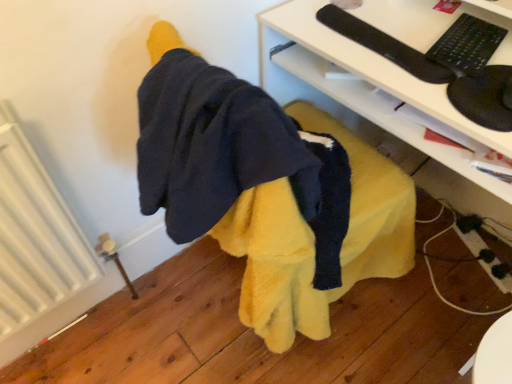
Question: From the image's perspective, relative to white glossy desk at center, is white ribbed radiator at left above or below?

Choices:
 (A) above
 (B) below

Answer: (B)

Question: Looking at their shapes, would you say white ribbed radiator at left is wider or thinner than white glossy desk at center?

Choices:
 (A) thin
 (B) wide

Answer: (A)

Question: Which object is the farthest from the white glossy desk at center?

Choices:
 (A) white ribbed radiator at left
 (B) black matte keyboard at upper right

Answer: (A)

Question: Considering the real-world distances, which object is closest to the white glossy desk at center?

Choices:
 (A) black matte keyboard at upper right
 (B) white ribbed radiator at left

Answer: (A)